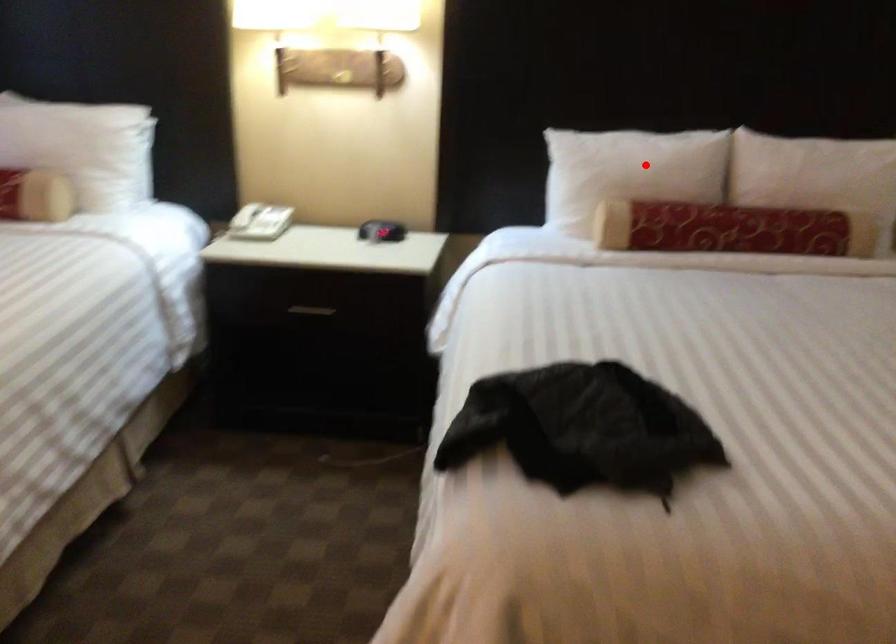
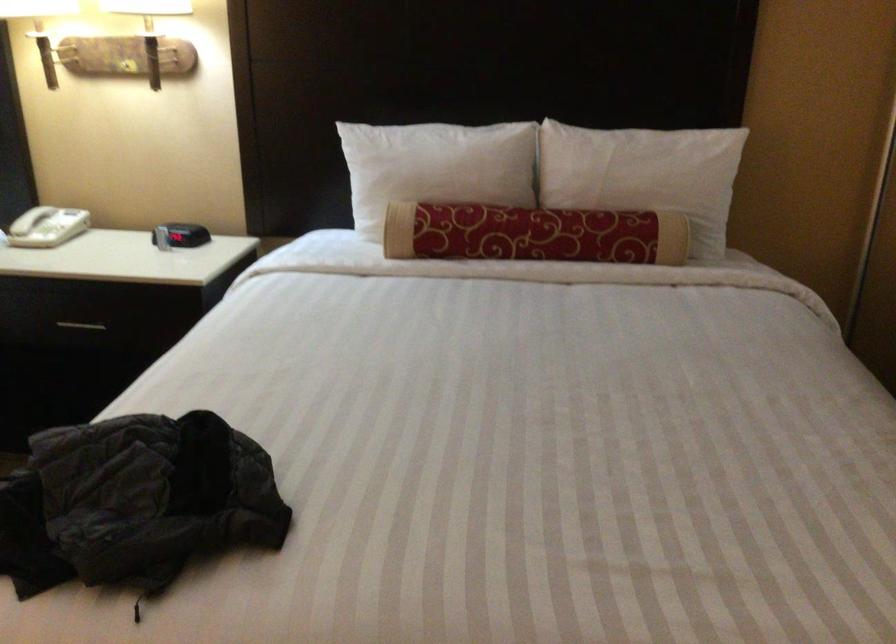
Find the pixel in the second image that matches the highlighted location in the first image.

(435, 167)